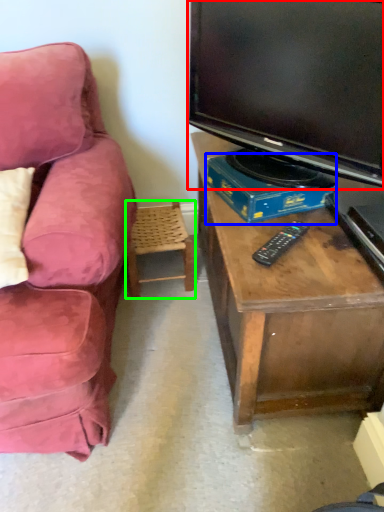
Question: Which object is positioned farthest from television (highlighted by a red box)? Select from book (highlighted by a blue box) and chair (highlighted by a green box).

Choices:
 (A) book
 (B) chair

Answer: (B)